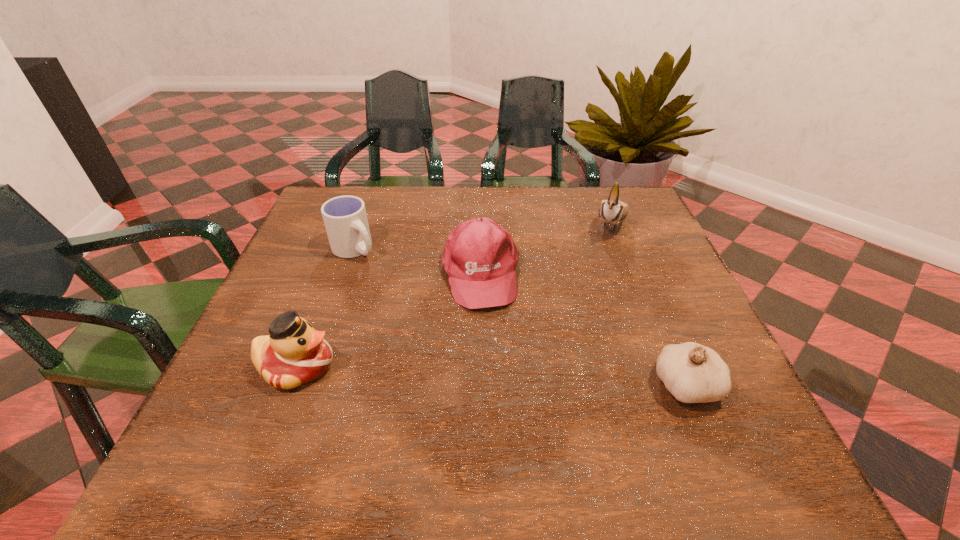
Locate an element on the screen. This screenshot has width=960, height=540. free region located at the front of the third object from right to left with the brim is located at coordinates (506, 408).

Find the location of `free space located 0.180m at the front of the third object from right to left with the brim`. free space located 0.180m at the front of the third object from right to left with the brim is located at coordinates (501, 384).

At what (x,y) coordinates should I click in order to perform the action: click on free space located at the front of the third object from right to left with the brim. Please return your answer as a coordinate pair (x, y). This screenshot has height=540, width=960. Looking at the image, I should click on (505, 403).

Find the location of a particular element. vacant space located at the face of the bird is located at coordinates (594, 288).

Identify the location of free space located 0.100m at the face of the bird. (602, 270).

This screenshot has width=960, height=540. Find the location of `vacant space located at the face of the bird`. vacant space located at the face of the bird is located at coordinates (580, 324).

Identify the location of object positioned at the far edge. The image size is (960, 540). (613, 210).

What are the coordinates of `duck positioned at the near edge` in the screenshot? It's located at (294, 353).

I want to click on garlic located at the near edge, so click(693, 373).

Image resolution: width=960 pixels, height=540 pixels. Find the location of `duck positioned at the left edge`. duck positioned at the left edge is located at coordinates [x=294, y=353].